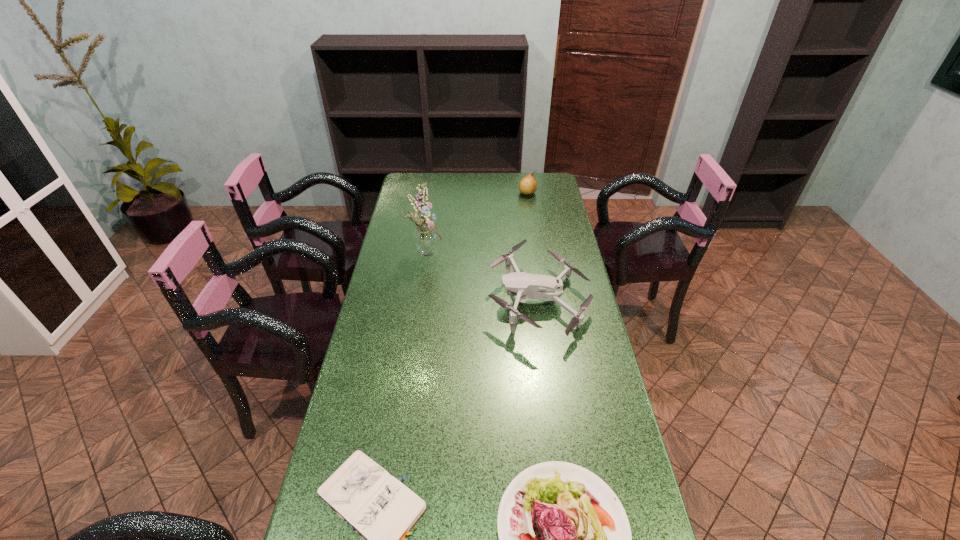
The width and height of the screenshot is (960, 540). Identify the location of bouquet. (426, 242).

Locate an element on the screen. The height and width of the screenshot is (540, 960). pear is located at coordinates (528, 185).

You are a GUI agent. You are given a task and a screenshot of the screen. Output one action in this format:
    pyautogui.click(x=<x>, y=<y>)
    Task: Click on the drone
    The height and width of the screenshot is (540, 960).
    Given the screenshot: What is the action you would take?
    pyautogui.click(x=525, y=286)

Image resolution: width=960 pixels, height=540 pixels. I want to click on free space located 0.270m on the front-facing side of the tallest object, so click(513, 252).

Find the location of a particular element. free point located 0.380m on the left of the pear is located at coordinates (437, 193).

The height and width of the screenshot is (540, 960). Find the location of `free spot located 0.170m with a camera at the front of the drone`. free spot located 0.170m with a camera at the front of the drone is located at coordinates (438, 300).

Locate an element on the screen. The image size is (960, 540). free spot located with a camera at the front of the drone is located at coordinates (408, 300).

Locate an element on the screen. The height and width of the screenshot is (540, 960). vacant point located with a camera at the front of the drone is located at coordinates (423, 300).

This screenshot has height=540, width=960. I want to click on object that is at the far edge, so click(x=528, y=185).

Find the location of `object that is at the left edge`. object that is at the left edge is located at coordinates (426, 242).